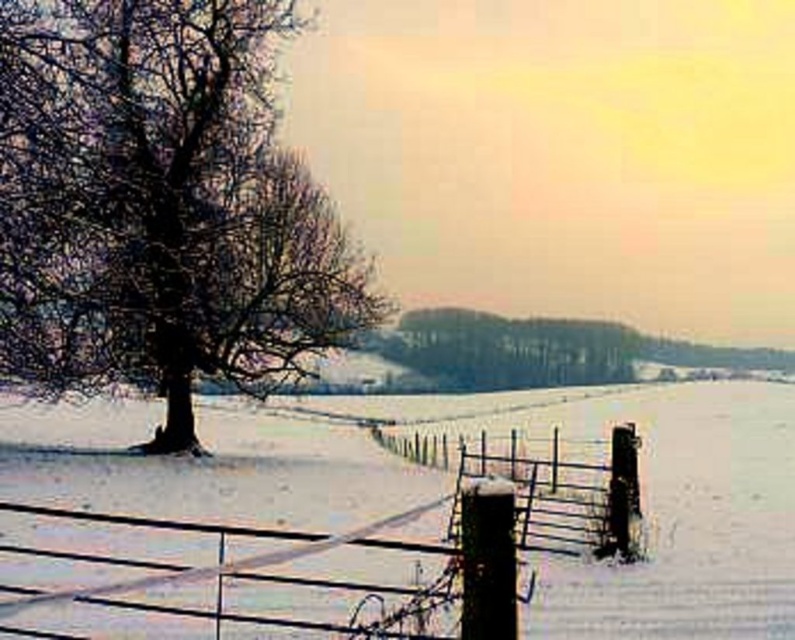
Does white frosty snow at center appear on the right side of snow-covered wooden fence post at lower right?

No, white frosty snow at center is not to the right of snow-covered wooden fence post at lower right.

Is point (510, 400) positioned in front of point (611, 452)?

No, it is not.

Which is behind, point (739, 384) or point (537, 461)?

Point (739, 384)

At what (x,y) coordinates should I click in order to perform the action: click on white frosty snow at center. Please return your answer as a coordinate pair (x, y). The width and height of the screenshot is (795, 640). Looking at the image, I should click on (681, 515).

Can you confirm if snow-covered tree at left is positioned to the right of snow-covered wooden fence post at lower right?

No, snow-covered tree at left is not to the right of snow-covered wooden fence post at lower right.

Can you confirm if snow-covered tree at left is positioned below snow-covered wooden fence post at lower right?

Actually, snow-covered tree at left is above snow-covered wooden fence post at lower right.

Which is in front, point (187, 257) or point (580, 531)?

Point (580, 531) is in front.

At what (x,y) coordinates should I click in order to perform the action: click on snow-covered tree at left. Please return your answer as a coordinate pair (x, y). The image size is (795, 640). Looking at the image, I should click on (161, 205).

Who is shorter, snow-covered tree at left or white frosty snow at center?

white frosty snow at center

Is snow-covered tree at left wider than white frosty snow at center?

No, snow-covered tree at left is not wider than white frosty snow at center.

Where is `snow-covered tree at left`? Image resolution: width=795 pixels, height=640 pixels. snow-covered tree at left is located at coordinates (161, 205).